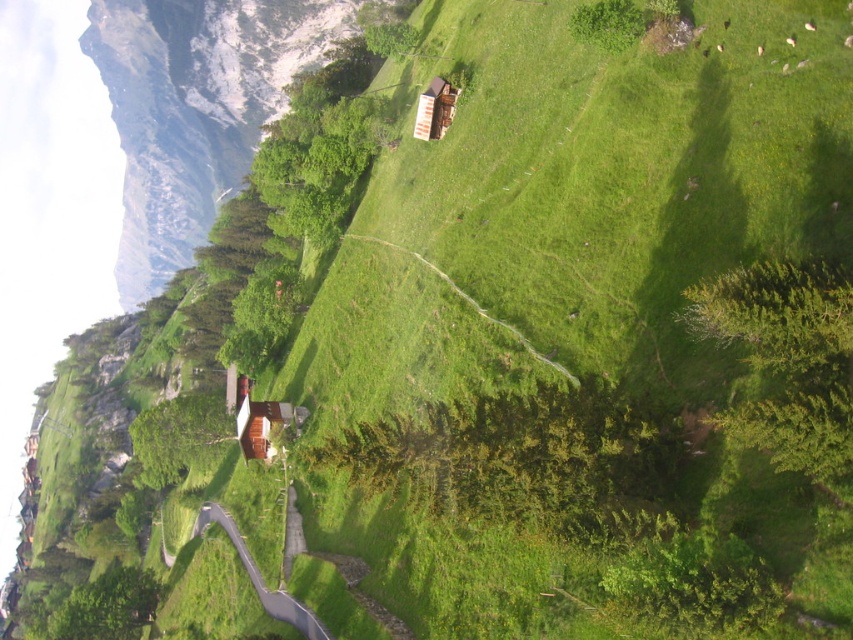
You are a gardener planning to mow the lawn around the dark gray asphalt path at lower center and the brown wooden cabin at center. Which area requires a wider mower path?

The dark gray asphalt path at lower center might require a wider mower path since it is possibly wider than the brown wooden cabin at center according to the description.

You are planning to build a new cabin in this area. You want to ensure that the new cabin will not block the view of the snowy rocky mountain at upper left from the wooden cabin at center. Based on their heights, is this possible?

The snowy rocky mountain at upper left is taller than the wooden cabin at center, so building the new cabin would not block the view of the snowy rocky mountain at upper left from the wooden cabin at center as long as the new cabin isn